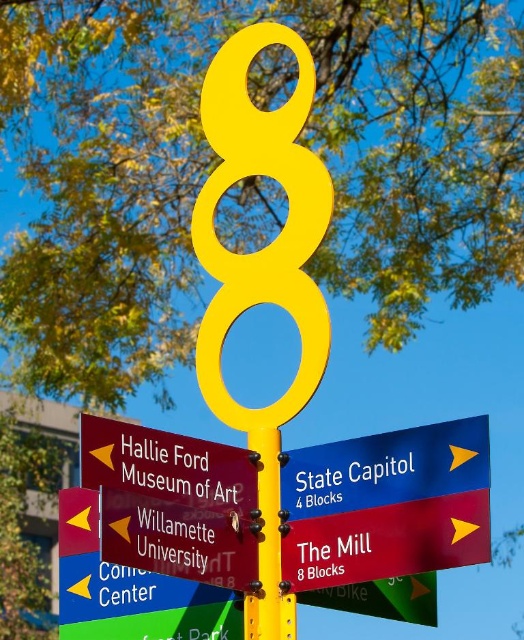
Who is positioned more to the left, metallic red sign at lower left or yellow matte pole at center?

From the viewer's perspective, metallic red sign at lower left appears more on the left side.

Can you confirm if metallic red sign at lower left is taller than yellow matte pole at center?

No, metallic red sign at lower left is not taller than yellow matte pole at center.

Who is more distant from viewer, [96,420] or [272,470]?

The point [272,470] is more distant.

Locate an element on the screen. This screenshot has height=640, width=524. metallic red sign at lower left is located at coordinates (167, 465).

Is metallic red sign at center smaller than metallic red sign at lower left?

Indeed, metallic red sign at center has a smaller size compared to metallic red sign at lower left.

Is metallic red sign at center further to camera compared to metallic red sign at lower left?

Yes, metallic red sign at center is behind metallic red sign at lower left.

Is point (205, 552) positioned in front of point (170, 452)?

No, (205, 552) is further to viewer.

This screenshot has height=640, width=524. Find the location of `metallic red sign at center`. metallic red sign at center is located at coordinates (181, 538).

Which is in front, point (174, 506) or point (275, 506)?

Point (174, 506) is in front.

What do you see at coordinates (181, 538) in the screenshot?
I see `metallic red sign at center` at bounding box center [181, 538].

Identify the location of metallic red sign at center. The height and width of the screenshot is (640, 524). (181, 538).